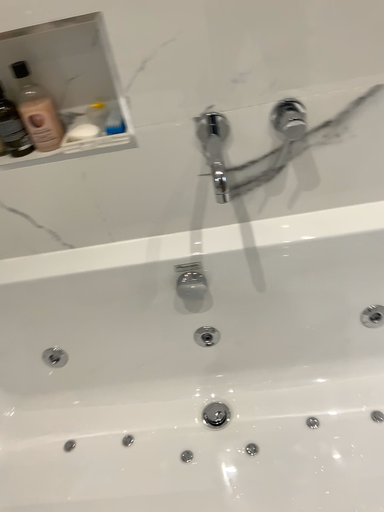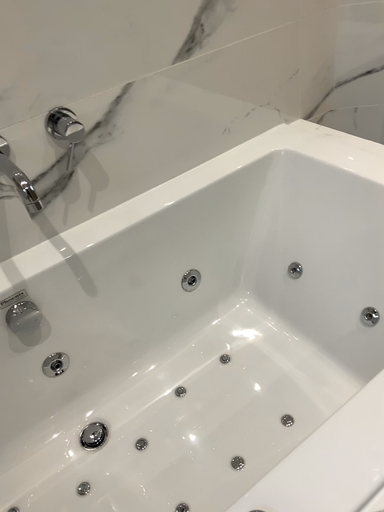
Question: How did the camera likely rotate when shooting the video?

Choices:
 (A) rotated downward
 (B) rotated upward

Answer: (B)